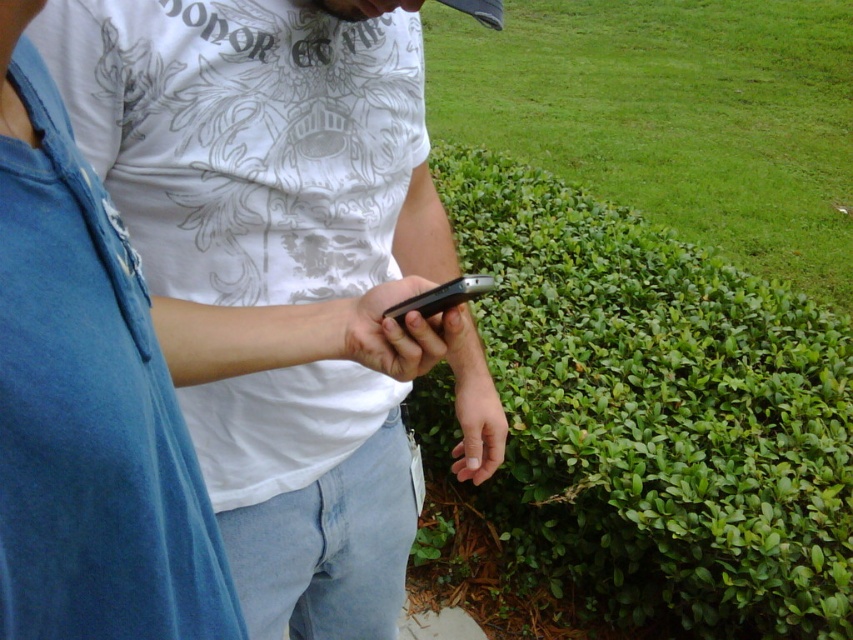
You are standing in a crowded event and want to locate the matte white shirt at center. According to the coordinates provided, where would you look to find it?

The matte white shirt at center is located at coordinates point (x=271, y=262).

You are standing at the point with coordinates point (432, 300) and want to walk to the point with coordinates point (625, 516). Is the destination point behind you or in front of you?

The destination point with coordinates point (625, 516) is behind the starting point with coordinates point (432, 300), so it is behind you.